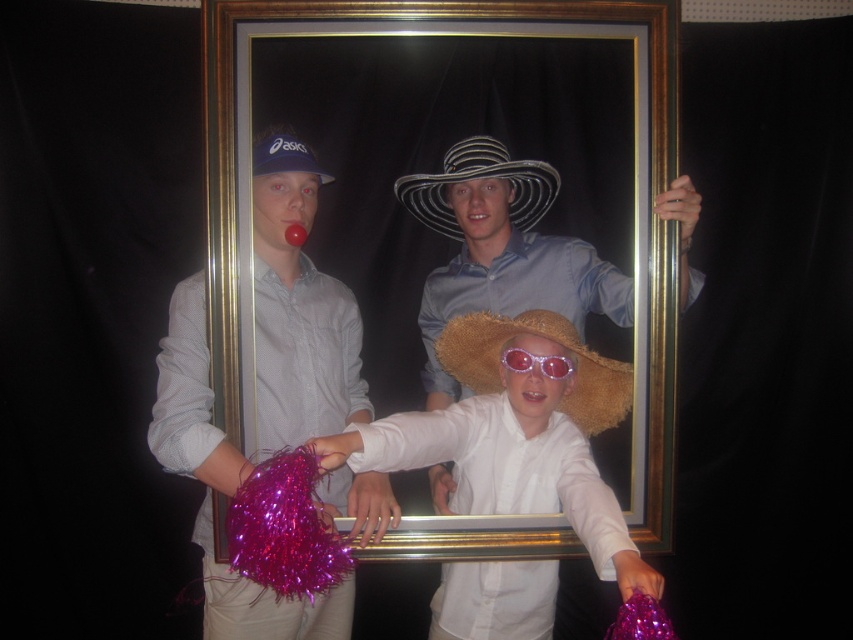
Which is more to the left, straw hat at center or matte blue cap at upper left?

Positioned to the left is matte blue cap at upper left.

Does straw hat at center have a smaller size compared to matte blue cap at upper left?

No.

Does point (552, 307) come behind point (271, 147)?

Yes, point (552, 307) is behind point (271, 147).

The width and height of the screenshot is (853, 640). Find the location of `straw hat at center`. straw hat at center is located at coordinates (502, 250).

Is matte blue cap at upper left taller than pink reflective sunglasses at center?

Indeed, matte blue cap at upper left has a greater height compared to pink reflective sunglasses at center.

Does matte blue cap at upper left have a lesser height compared to pink reflective sunglasses at center?

No.

I want to click on matte blue cap at upper left, so click(283, 156).

Identify the location of matte blue cap at upper left. (283, 156).

Can you confirm if gold metallic picture frame at center is smaller than black and white striped cowboy hat at center?

Incorrect, gold metallic picture frame at center is not smaller in size than black and white striped cowboy hat at center.

Is gold metallic picture frame at center closer to the viewer compared to black and white striped cowboy hat at center?

Yes, gold metallic picture frame at center is in front of black and white striped cowboy hat at center.

Find the location of a particular element. gold metallic picture frame at center is located at coordinates (451, 182).